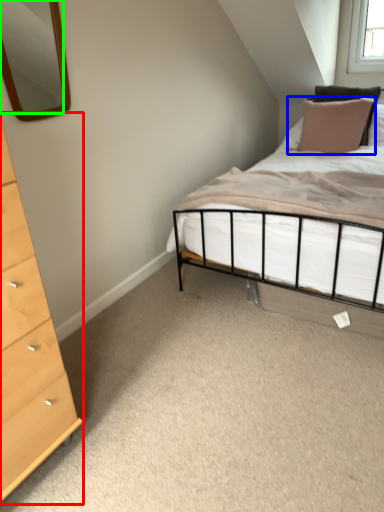
Question: Estimate the real-world distances between objects in this image. Which object is farther from chest of drawers (highlighted by a red box), pillow (highlighted by a blue box) or mirror (highlighted by a green box)?

Choices:
 (A) pillow
 (B) mirror

Answer: (B)